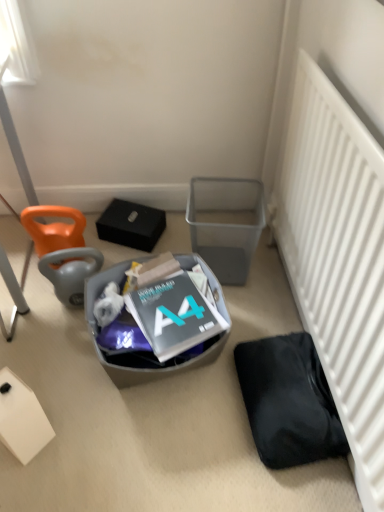
In order to face black matte bag at lower right, should I rotate leftwards or rightwards?

You should look right and rotate roughly 11.902 degrees.

The height and width of the screenshot is (512, 384). Describe the element at coordinates (226, 224) in the screenshot. I see `metallic gray trash bin at center right, the 1th trash bin/can when ordered from right to left` at that location.

What is the approximate width of translucent plastic trash bin at center, which is the first trash bin/can from left to right?

translucent plastic trash bin at center, which is the first trash bin/can from left to right, is 49.24 centimeters wide.

Where is `black matte bag at lower right`? black matte bag at lower right is located at coordinates (288, 401).

Locate an element on the screen. the 1st bean bag chair above when counting from the white matte box at lower left (from the image's perspective) is located at coordinates (62, 251).

Which point is more forward, (x=43, y=224) or (x=19, y=381)?

Point (x=19, y=381)

Is orange fabric bean bag chair at left, which ranks as the second bean bag chair in top-to-bottom order, beside white matte box at lower left?

orange fabric bean bag chair at left, which ranks as the second bean bag chair in top-to-bottom order, and white matte box at lower left are clearly separated.

Is orange fabric bean bag chair at left, which ranks as the second bean bag chair in top-to-bottom order, thinner than white matte box at lower left?

No.

Locate an element on the screen. The width and height of the screenshot is (384, 512). wide that appears behind the translucent plastic trash bin at center, which is the first trash bin/can from left to right is located at coordinates (288, 401).

Which is in front, point (92, 289) or point (286, 391)?

The point (286, 391) is in front.

Can you tell me how much translucent plastic trash bin at center, positioned as the second trash bin/can in right-to-left order, and black matte bag at lower right differ in facing direction?

96 degrees separate the facing orientations of translucent plastic trash bin at center, positioned as the second trash bin/can in right-to-left order, and black matte bag at lower right.

Which object is positioned more to the right, translucent plastic trash bin at center, which is the first trash bin/can from left to right, or black matte bag at lower right?

black matte bag at lower right.

From a real-world perspective, is orange fabric bean bag chair at left, which ranks as the second bean bag chair in top-to-bottom order, physically above white matte radiator at lower right?

No, from a real-world perspective, orange fabric bean bag chair at left, which ranks as the second bean bag chair in top-to-bottom order, is not over white matte radiator at lower right

Does point (63, 269) come closer to viewer compared to point (298, 73)?

No.

Which object is more forward, orange fabric bean bag chair at left, which ranks as the second bean bag chair in top-to-bottom order, or white matte radiator at lower right?

white matte radiator at lower right is closer to the camera.

Can we say orange fabric bean bag chair at left, which ranks as the second bean bag chair in top-to-bottom order, lies outside white matte radiator at lower right?

Yes, orange fabric bean bag chair at left, which ranks as the second bean bag chair in top-to-bottom order, is located beyond the bounds of white matte radiator at lower right.

Can you confirm if white matte box at lower left is wider than metallic gray trash bin at center right, the 2th trash bin/can in the left-to-right sequence?

No.

Which point is more forward, (36, 400) or (236, 252)?

The point (36, 400) is closer.

Is white matte box at lower left oriented towards metallic gray trash bin at center right, the 1th trash bin/can when ordered from right to left?

No, white matte box at lower left is not aimed at metallic gray trash bin at center right, the 1th trash bin/can when ordered from right to left.

How distant is white matte box at lower left from metallic gray trash bin at center right, the 1th trash bin/can when ordered from right to left?

white matte box at lower left and metallic gray trash bin at center right, the 1th trash bin/can when ordered from right to left, are 34.70 inches apart from each other.

Which object is positioned more to the right, translucent plastic trash bin at center, which is the first trash bin/can from left to right, or orange fabric bean bag chair at left, which ranks as the second bean bag chair in bottom-to-top order?

translucent plastic trash bin at center, which is the first trash bin/can from left to right.

Is translucent plastic trash bin at center, positioned as the second trash bin/can in right-to-left order, not close to orange fabric bean bag chair at left, which ranks as the second bean bag chair in bottom-to-top order?

translucent plastic trash bin at center, positioned as the second trash bin/can in right-to-left order, is actually quite close to orange fabric bean bag chair at left, which ranks as the second bean bag chair in bottom-to-top order.

Where is `trash bin/can below the orange fabric bean bag chair at left, which is counted as the first bean bag chair, starting from the top (from a real-world perspective)`? trash bin/can below the orange fabric bean bag chair at left, which is counted as the first bean bag chair, starting from the top (from a real-world perspective) is located at coordinates (134, 354).

Who is smaller, translucent plastic trash bin at center, which is the first trash bin/can from left to right, or orange fabric bean bag chair at left, which ranks as the second bean bag chair in bottom-to-top order?

Smaller between the two is orange fabric bean bag chair at left, which ranks as the second bean bag chair in bottom-to-top order.

Is white matte radiator at lower right at the right side of white matte box at lower left?

Correct, you'll find white matte radiator at lower right to the right of white matte box at lower left.

Do you think white matte radiator at lower right is within white matte box at lower left, or outside of it?

white matte radiator at lower right is outside white matte box at lower left.

In the scene shown: Are white matte radiator at lower right and white matte box at lower left far apart?

No.

Considering the positions of points (325, 190) and (40, 420), is point (325, 190) farther from camera compared to point (40, 420)?

Yes, point (325, 190) is behind point (40, 420).

From a real-world perspective, who is located lower, white matte box at lower left or orange fabric bean bag chair at left, positioned as the first bean bag chair in bottom-to-top order?

white matte box at lower left.

Is white matte box at lower left taller or shorter than orange fabric bean bag chair at left, which ranks as the second bean bag chair in top-to-bottom order?

Clearly, white matte box at lower left is taller compared to orange fabric bean bag chair at left, which ranks as the second bean bag chair in top-to-bottom order.

Is white matte box at lower left turned away from orange fabric bean bag chair at left, positioned as the first bean bag chair in bottom-to-top order?

white matte box at lower left does not have its back to orange fabric bean bag chair at left, positioned as the first bean bag chair in bottom-to-top order.

From the image's perspective, which is below, white matte box at lower left or orange fabric bean bag chair at left, positioned as the first bean bag chair in bottom-to-top order?

white matte box at lower left.

Identify the location of box on the left side of orange fabric bean bag chair at left, positioned as the first bean bag chair in bottom-to-top order. The image size is (384, 512). (22, 419).

I want to click on the 1st trash bin/can positioned above the black matte bag at lower right (from a real-world perspective), so click(134, 354).

Which object lies nearer to the anchor point translucent plastic trash bin at center, positioned as the second trash bin/can in right-to-left order, white matte radiator at lower right or black matte bag at lower right?

The object closer to translucent plastic trash bin at center, positioned as the second trash bin/can in right-to-left order, is black matte bag at lower right.

Looking at the image, which one is located closer to metallic gray trash bin at center right, the 1th trash bin/can when ordered from right to left, orange fabric bean bag chair at left, which ranks as the second bean bag chair in top-to-bottom order, or white matte radiator at lower right?

Among the two, white matte radiator at lower right is located nearer to metallic gray trash bin at center right, the 1th trash bin/can when ordered from right to left.

Which object lies nearer to the anchor point metallic gray trash bin at center right, the 2th trash bin/can in the left-to-right sequence, white matte radiator at lower right or orange fabric bean bag chair at left, which ranks as the second bean bag chair in bottom-to-top order?

white matte radiator at lower right.

Estimate the real-world distances between objects in this image. Which object is closer to white matte box at lower left, black matte bag at lower right or metallic gray trash bin at center right, the 2th trash bin/can in the left-to-right sequence?

black matte bag at lower right is positioned closer to the anchor white matte box at lower left.

Based on their spatial positions, is translucent plastic trash bin at center, which is the first trash bin/can from left to right, or black matte bag at lower right further from orange fabric bean bag chair at left, which is counted as the first bean bag chair, starting from the top?

black matte bag at lower right lies further to orange fabric bean bag chair at left, which is counted as the first bean bag chair, starting from the top, than the other object.

From the image, which object appears to be farther from orange fabric bean bag chair at left, positioned as the first bean bag chair in bottom-to-top order, white matte box at lower left or translucent plastic trash bin at center, positioned as the second trash bin/can in right-to-left order?

white matte box at lower left is further to orange fabric bean bag chair at left, positioned as the first bean bag chair in bottom-to-top order.

Consider the image. Which object lies further to the anchor point orange fabric bean bag chair at left, which is counted as the first bean bag chair, starting from the top, white matte box at lower left or orange fabric bean bag chair at left, which ranks as the second bean bag chair in top-to-bottom order?

The object further to orange fabric bean bag chair at left, which is counted as the first bean bag chair, starting from the top, is white matte box at lower left.

Which object lies further to the anchor point black matte bag at lower right, metallic gray trash bin at center right, the 1th trash bin/can when ordered from right to left, or orange fabric bean bag chair at left, which ranks as the second bean bag chair in bottom-to-top order?

The object further to black matte bag at lower right is orange fabric bean bag chair at left, which ranks as the second bean bag chair in bottom-to-top order.

Identify the location of bean bag chair that lies between orange fabric bean bag chair at left, which ranks as the second bean bag chair in bottom-to-top order, and white matte box at lower left from top to bottom. (62, 251).

Where is `wide between white matte radiator at lower right and metallic gray trash bin at center right, the 2th trash bin/can in the left-to-right sequence, along the z-axis`? The image size is (384, 512). wide between white matte radiator at lower right and metallic gray trash bin at center right, the 2th trash bin/can in the left-to-right sequence, along the z-axis is located at coordinates (288, 401).

I want to click on bean bag chair situated between white matte box at lower left and black matte bag at lower right from left to right, so click(x=62, y=251).

Image resolution: width=384 pixels, height=512 pixels. Identify the location of bean bag chair between orange fabric bean bag chair at left, which is counted as the first bean bag chair, starting from the top, and black matte bag at lower right, in the horizontal direction. (62, 251).